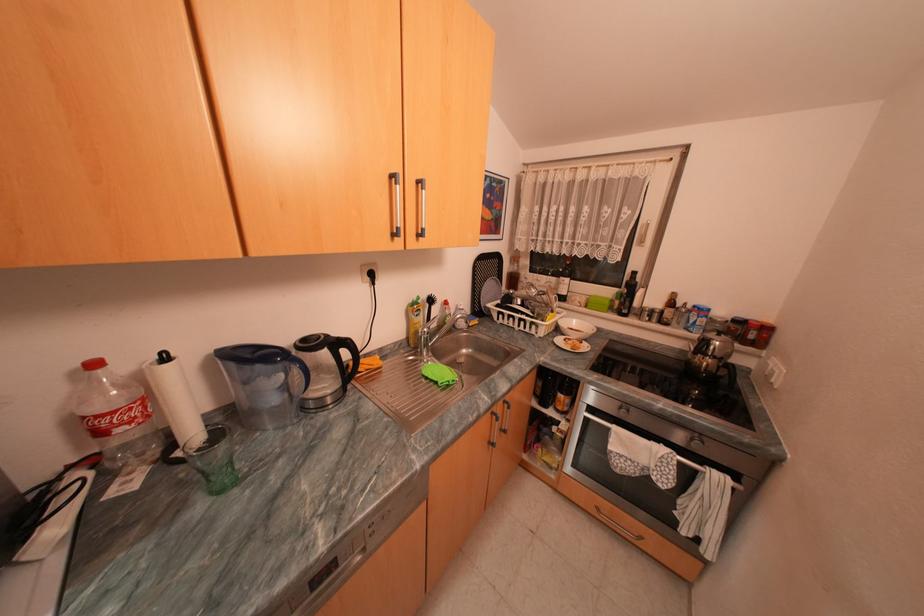
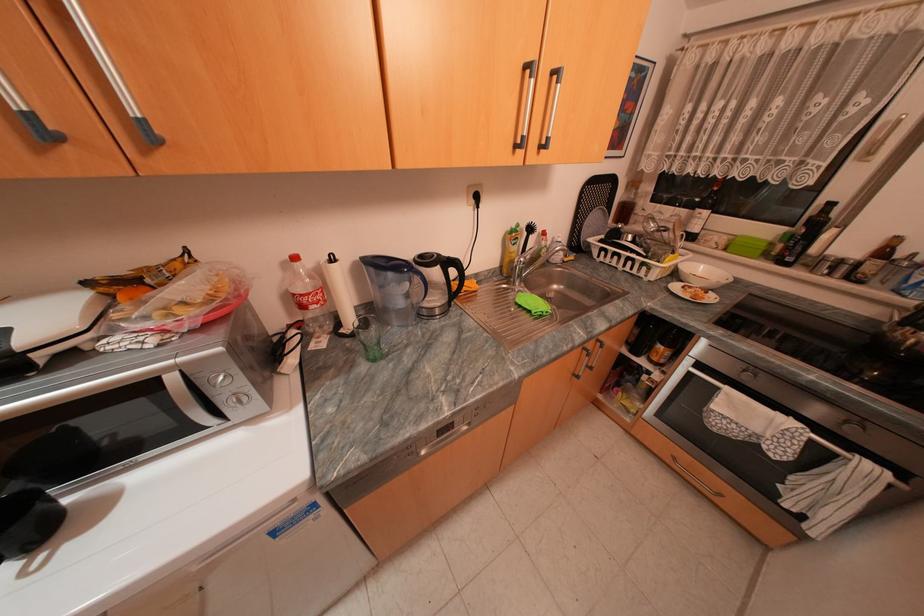
Question: In a continuous first-person perspective shot, in which direction is the camera moving?

Choices:
 (A) Left
 (B) Right
 (C) Forward
 (D) Backward

Answer: (A)